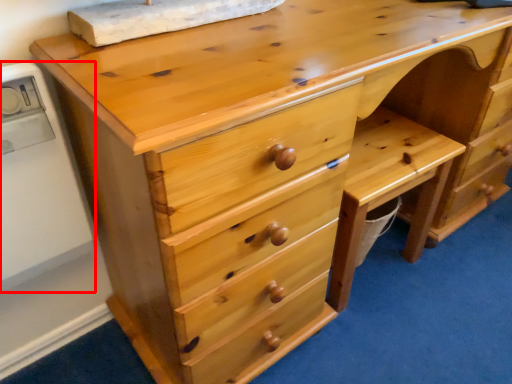
Question: In this image, where is appliance (annotated by the red box) located relative to cabinetry?

Choices:
 (A) left
 (B) right

Answer: (A)